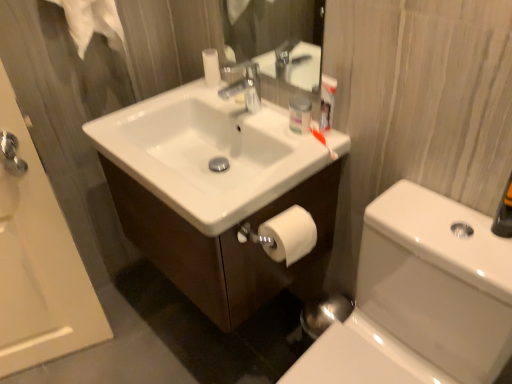
Question: Can you confirm if white matte toilet paper at lower right is bigger than white glossy cabinet at center?

Choices:
 (A) no
 (B) yes

Answer: (A)

Question: Does white matte toilet paper at lower right have a greater height compared to white glossy cabinet at center?

Choices:
 (A) no
 (B) yes

Answer: (A)

Question: Is white matte toilet paper at lower right smaller than white glossy cabinet at center?

Choices:
 (A) yes
 (B) no

Answer: (A)

Question: Considering the relative positions of white matte toilet paper at lower right and white glossy cabinet at center in the image provided, is white matte toilet paper at lower right to the left of white glossy cabinet at center from the viewer's perspective?

Choices:
 (A) no
 (B) yes

Answer: (A)

Question: From the image's perspective, does white matte toilet paper at lower right appear higher than white glossy cabinet at center?

Choices:
 (A) yes
 (B) no

Answer: (B)

Question: Is point (385, 350) positioned closer to the camera than point (293, 109)?

Choices:
 (A) farther
 (B) closer

Answer: (B)

Question: From a real-world perspective, relative to matte plastic container at upper center, is white glossy toilet bowl at lower right vertically above or below?

Choices:
 (A) below
 (B) above

Answer: (A)

Question: Is white glossy toilet bowl at lower right inside or outside of matte plastic container at upper center?

Choices:
 (A) inside
 (B) outside

Answer: (B)

Question: Looking at the image, does white glossy toilet bowl at lower right seem bigger or smaller compared to matte plastic container at upper center?

Choices:
 (A) big
 (B) small

Answer: (A)

Question: Does point (165, 251) appear closer or farther from the camera than point (181, 110)?

Choices:
 (A) farther
 (B) closer

Answer: (B)

Question: From a real-world perspective, is white glossy cabinet at center physically located above or below white glossy sink at center?

Choices:
 (A) below
 (B) above

Answer: (A)

Question: Considering the positions of white glossy cabinet at center and white glossy sink at center in the image, is white glossy cabinet at center wider or thinner than white glossy sink at center?

Choices:
 (A) wide
 (B) thin

Answer: (B)

Question: From the image's perspective, relative to white glossy sink at center, is white glossy cabinet at center above or below?

Choices:
 (A) above
 (B) below

Answer: (B)

Question: Is white glossy bathtub at upper left in front of or behind white matte toilet paper at lower right in the image?

Choices:
 (A) behind
 (B) front

Answer: (B)

Question: Considering the positions of point (16, 144) and point (308, 236), is point (16, 144) closer or farther from the camera than point (308, 236)?

Choices:
 (A) farther
 (B) closer

Answer: (A)